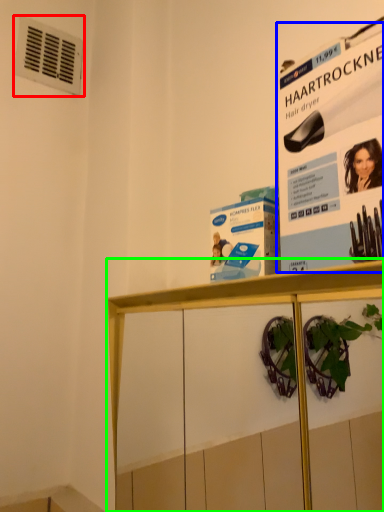
Question: Which object is positioned farthest from air conditioning (highlighted by a red box)? Select from poster page (highlighted by a blue box) and shelf (highlighted by a green box).

Choices:
 (A) poster page
 (B) shelf

Answer: (A)